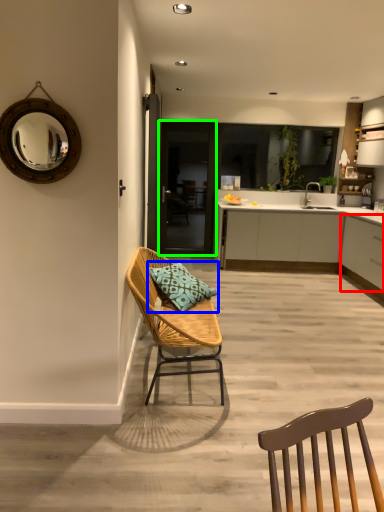
Question: Based on their relative distances, which object is farther from cabinetry (highlighted by a red box)? Choose from pillow (highlighted by a blue box) and glass door (highlighted by a green box).

Choices:
 (A) pillow
 (B) glass door

Answer: (B)